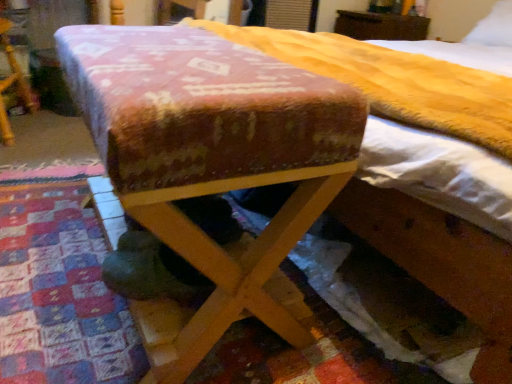
Question: From a real-world perspective, relative to white soft pillow at upper right, is textured wool mattress at center vertically above or below?

Choices:
 (A) above
 (B) below

Answer: (B)

Question: In terms of size, does textured wool mattress at center appear bigger or smaller than white soft pillow at upper right?

Choices:
 (A) big
 (B) small

Answer: (A)

Question: Based on their relative distances, which object is farther from the white soft pillow at upper right?

Choices:
 (A) brown wooden dresser at upper center, the 1th furniture viewed from the right
 (B) velvet-like fabric ottoman at center, the third furniture in the back-to-front sequence
 (C) textured wool mattress at center
 (D) wooden folding table at center, which ranks as the first furniture in left-to-right order
 (E) wooden bed at center

Answer: (D)

Question: Which object is positioned closest to the wooden bed at center?

Choices:
 (A) textured wool mattress at center
 (B) velvet-like fabric ottoman at center, the third furniture in the back-to-front sequence
 (C) brown wooden dresser at upper center, the 1th furniture viewed from the right
 (D) white soft pillow at upper right
 (E) wooden folding table at center, marked as the 2th furniture in a front-to-back arrangement

Answer: (B)